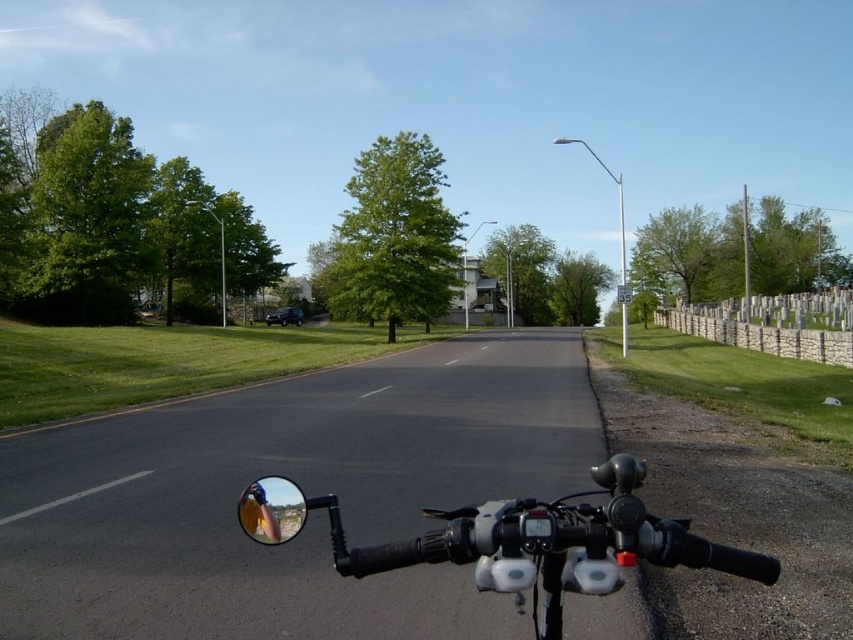
From the picture: Does black matte motorcycle handlebars at center appear on the right side of shiny chrome mirror at lower left?

Yes, black matte motorcycle handlebars at center is to the right of shiny chrome mirror at lower left.

Between point (485, 536) and point (294, 509), which one is positioned behind?

Point (294, 509)

I want to click on black matte motorcycle handlebars at center, so click(518, 540).

Between shiny chrome mirror at lower left and shiny chrome mirror at center, which one has less height?

Standing shorter between the two is shiny chrome mirror at center.

Who is lower down, shiny chrome mirror at lower left or shiny chrome mirror at center?

shiny chrome mirror at center is lower down.

Describe the element at coordinates (283, 513) in the screenshot. I see `shiny chrome mirror at lower left` at that location.

Find the location of `shiny chrome mirror at lower left`. shiny chrome mirror at lower left is located at coordinates (283, 513).

Who is higher up, black matte motorcycle handlebars at center or shiny chrome mirror at center?

Positioned higher is shiny chrome mirror at center.

What do you see at coordinates (518, 540) in the screenshot? Image resolution: width=853 pixels, height=640 pixels. I see `black matte motorcycle handlebars at center` at bounding box center [518, 540].

Who is more forward, (x=563, y=576) or (x=294, y=500)?

Point (x=563, y=576) is in front.

The image size is (853, 640). Find the location of `black matte motorcycle handlebars at center`. black matte motorcycle handlebars at center is located at coordinates (518, 540).